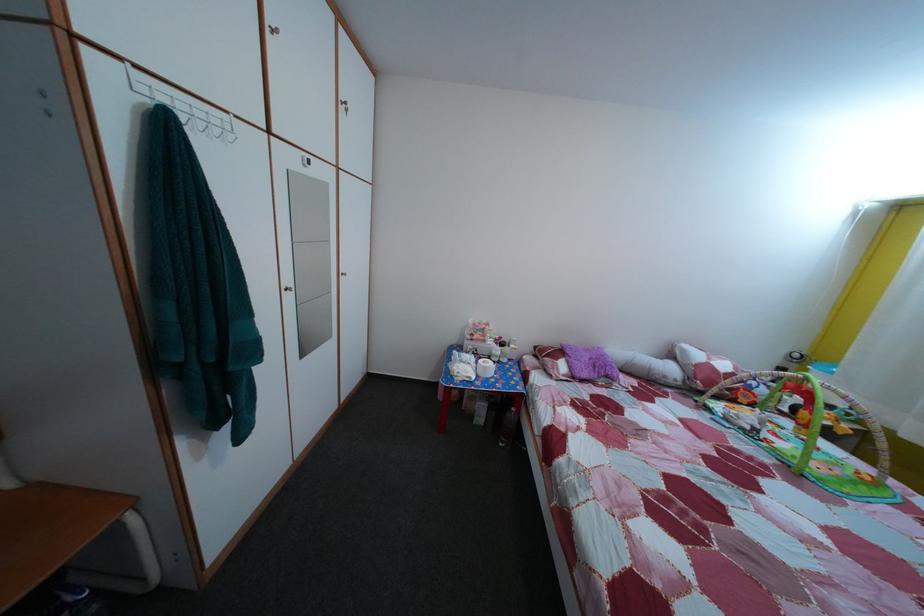
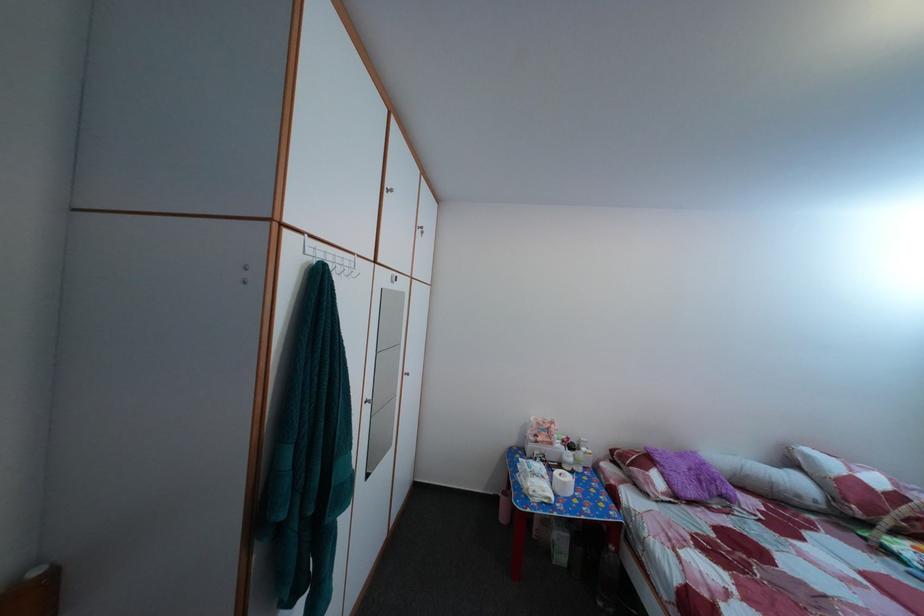
Find the pixel in the second image that matches the point at 675,385 in the first image.

(808, 504)